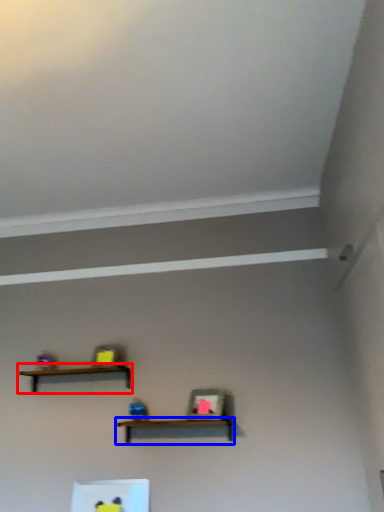
Question: Which point is further to the camera, shelf (highlighted by a red box) or shelf (highlighted by a blue box)?

Choices:
 (A) shelf
 (B) shelf

Answer: (A)